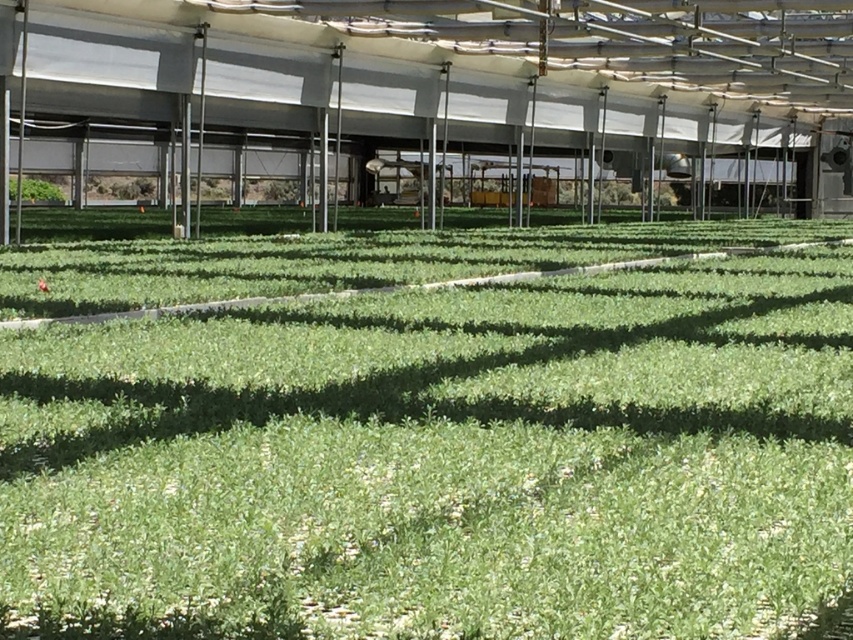
Question: Which of the following is the closest to the observer?

Choices:
 (A) green leafy plant at left
 (B) green leafy grass at center

Answer: (B)

Question: Among these objects, which one is nearest to the camera?

Choices:
 (A) green leafy plant at left
 (B) green leafy grass at center

Answer: (B)

Question: Is green leafy grass at center to the right of green leafy plant at left from the viewer's perspective?

Choices:
 (A) no
 (B) yes

Answer: (B)

Question: Among these points, which one is nearest to the camera?

Choices:
 (A) (583, 634)
 (B) (47, 186)

Answer: (A)

Question: Is green leafy grass at center to the left of green leafy plant at left from the viewer's perspective?

Choices:
 (A) no
 (B) yes

Answer: (A)

Question: Is green leafy grass at center thinner than green leafy plant at left?

Choices:
 (A) yes
 (B) no

Answer: (B)